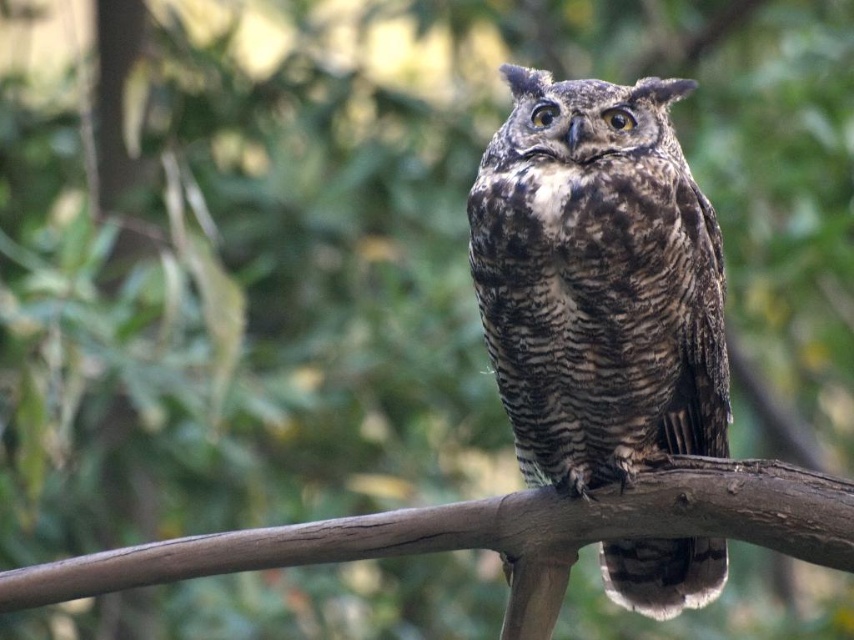
Does brown speckled owl at center have a lesser height compared to brown wood at center?

In fact, brown speckled owl at center may be taller than brown wood at center.

Does brown speckled owl at center appear over brown wood at center?

Indeed, brown speckled owl at center is positioned over brown wood at center.

Which is behind, point (553, 102) or point (665, 468)?

The point (553, 102) is behind.

Find the location of a particular element. This screenshot has height=640, width=854. brown speckled owl at center is located at coordinates (598, 282).